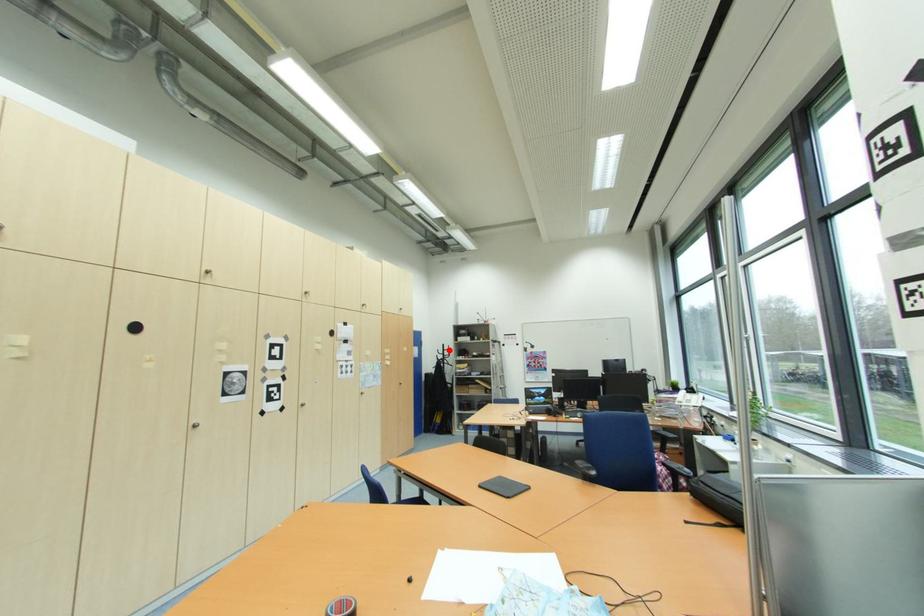
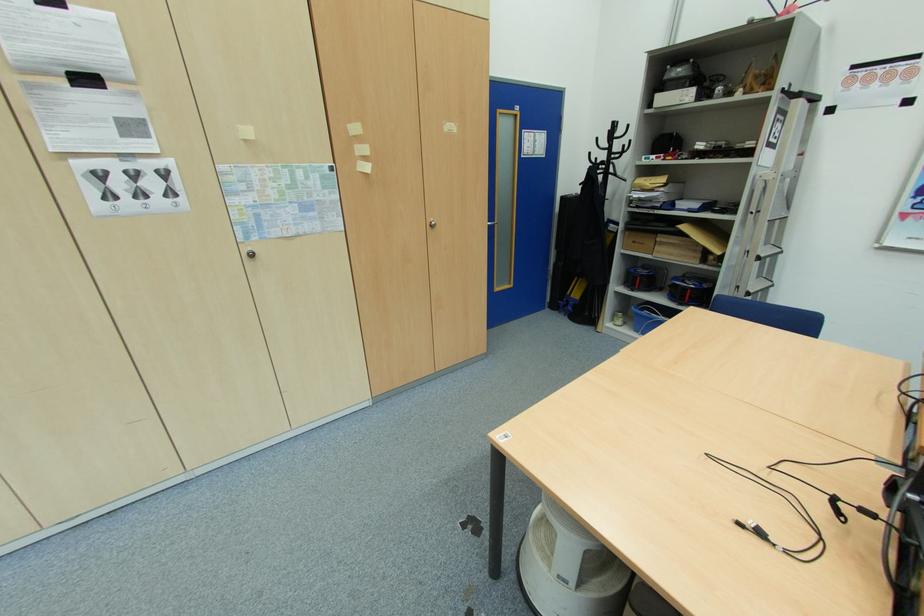
Question: I am providing you with two images of the same scene from different viewpoints. A red point is marked on the first image. At the location where the point appears in image 1, is it still visible in image 2?

Choices:
 (A) Yes
 (B) No

Answer: (A)